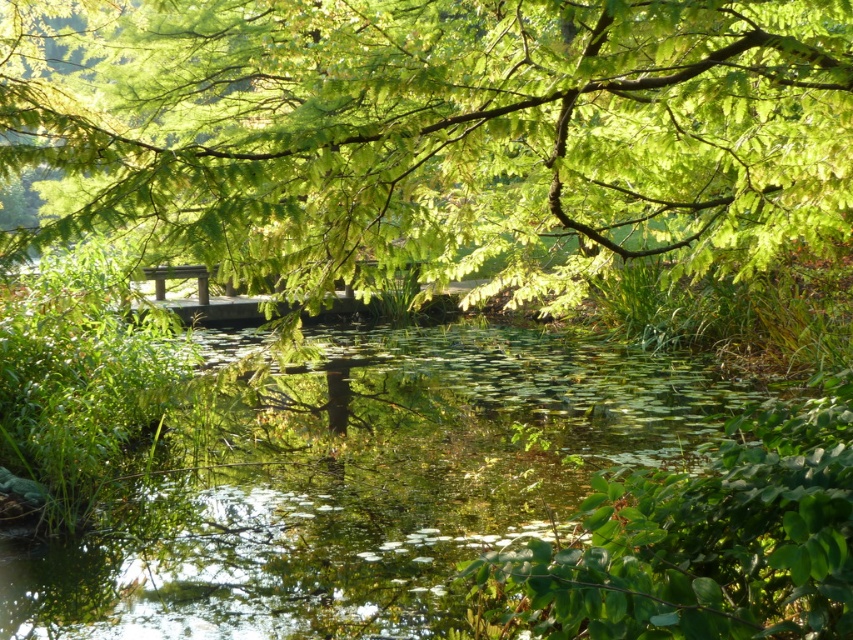
You are standing at the edge of the pond and want to take a photo of the green leafy tree at upper center. If your camera has a fixed focus set at 0.5 meters, will the tree be in focus? Please explain based on its position.

The green leafy tree at upper center is located at coordinates (x=436, y=132) in the image. Since the camera is focused at 0.5 meters, the tree may not be in focus as its position is slightly beyond the focal point. However, without depth information, we can only assume based on the 2D coordinates that it might be out of focus.

You are standing on the wooden bridge and looking towards the green leafy tree at upper center and the green leafy water at center. Which object is positioned higher in the scene?

The green leafy tree at upper center is positioned higher than the green leafy water at center in the scene.

You are standing at the wooden bridge and want to walk towards the point labeled point (194, 611). Which direction should you move relative to the point labeled point (567, 237)?

Since point (567, 237) is closer to you than point (194, 611), you should move away from point (567, 237) to reach point (194, 611).